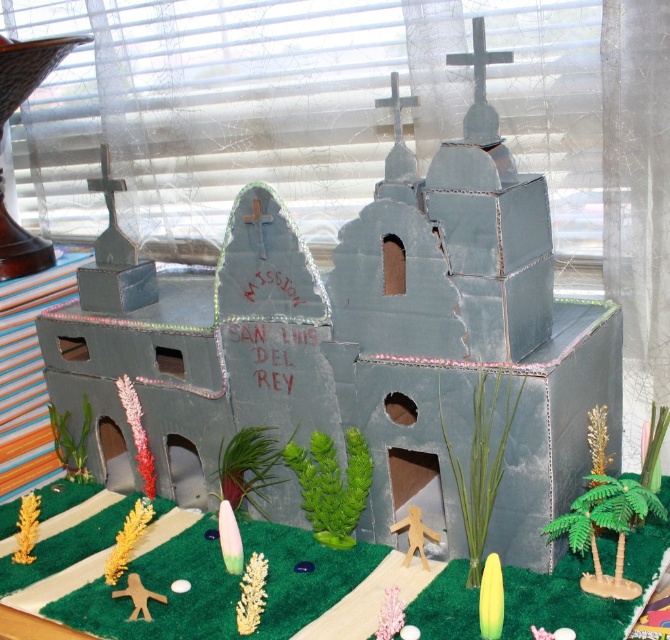
Question: Which point is farther to the camera?

Choices:
 (A) (490, 604)
 (B) (561, 630)
 (C) (335, 484)

Answer: (C)

Question: Which of these objects is positioned closest to the green matte plant at center?

Choices:
 (A) green matte surfboard at lower center
 (B) gold textured plant at lower center
 (C) gold textured plant at lower left
 (D) green felt at center

Answer: (B)

Question: Is green matte surfboard at lower center positioned behind wooden figure at center?

Choices:
 (A) yes
 (B) no

Answer: (B)

Question: In this image, where is green matte plant at center located relative to gold textured plant at lower left?

Choices:
 (A) above
 (B) below

Answer: (A)

Question: Which object appears farthest from the camera in this image?

Choices:
 (A) wooden figure at center
 (B) gold textured plant at lower center
 (C) green matte plant at center

Answer: (C)

Question: Does green matte plant at center have a greater width compared to gold textured plant at lower left?

Choices:
 (A) no
 (B) yes

Answer: (B)